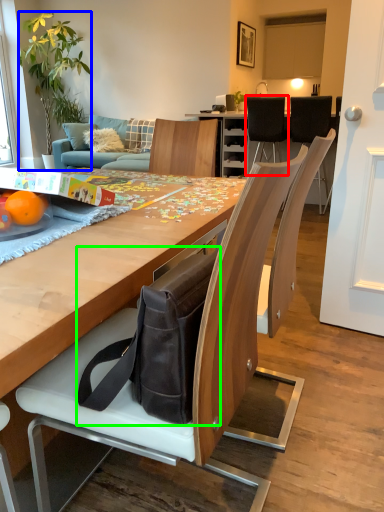
Question: Which object is positioned farthest from chair (highlighted by a red box)? Select from houseplant (highlighted by a blue box) and messenger bag (highlighted by a green box).

Choices:
 (A) houseplant
 (B) messenger bag

Answer: (B)